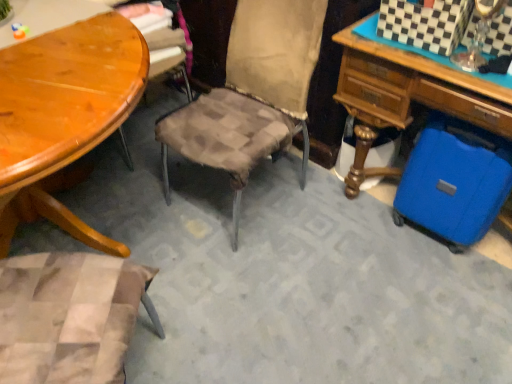
Question: Is blue hard plastic suitcase at lower right surrounded by shiny wood table at left?

Choices:
 (A) no
 (B) yes

Answer: (A)

Question: Is shiny wood table at left smaller than blue hard plastic suitcase at lower right?

Choices:
 (A) no
 (B) yes

Answer: (B)

Question: Does shiny wood table at left have a greater height compared to blue hard plastic suitcase at lower right?

Choices:
 (A) no
 (B) yes

Answer: (B)

Question: Could you tell me if shiny wood table at left is turned towards blue hard plastic suitcase at lower right?

Choices:
 (A) no
 (B) yes

Answer: (A)

Question: Is shiny wood table at left closer to the viewer compared to blue hard plastic suitcase at lower right?

Choices:
 (A) yes
 (B) no

Answer: (A)

Question: Considering the relative sizes of shiny wood table at left and blue hard plastic suitcase at lower right in the image provided, is shiny wood table at left wider than blue hard plastic suitcase at lower right?

Choices:
 (A) yes
 (B) no

Answer: (A)

Question: Is blue hard plastic suitcase at lower right facing towards shiny wood table at left?

Choices:
 (A) yes
 (B) no

Answer: (A)

Question: From a real-world perspective, does blue hard plastic suitcase at lower right sit lower than shiny wood table at left?

Choices:
 (A) no
 (B) yes

Answer: (B)

Question: From the image's perspective, would you say blue hard plastic suitcase at lower right is positioned over shiny wood table at left?

Choices:
 (A) yes
 (B) no

Answer: (A)

Question: Can you confirm if blue hard plastic suitcase at lower right is thinner than shiny wood table at left?

Choices:
 (A) yes
 (B) no

Answer: (A)

Question: From a real-world perspective, is blue hard plastic suitcase at lower right on shiny wood table at left?

Choices:
 (A) yes
 (B) no

Answer: (B)

Question: Considering the relative sizes of blue hard plastic suitcase at lower right and shiny wood table at left in the image provided, is blue hard plastic suitcase at lower right wider than shiny wood table at left?

Choices:
 (A) no
 (B) yes

Answer: (A)

Question: Is shiny wood table at left at the back of blue hardshell suitcase at lower right?

Choices:
 (A) no
 (B) yes

Answer: (A)